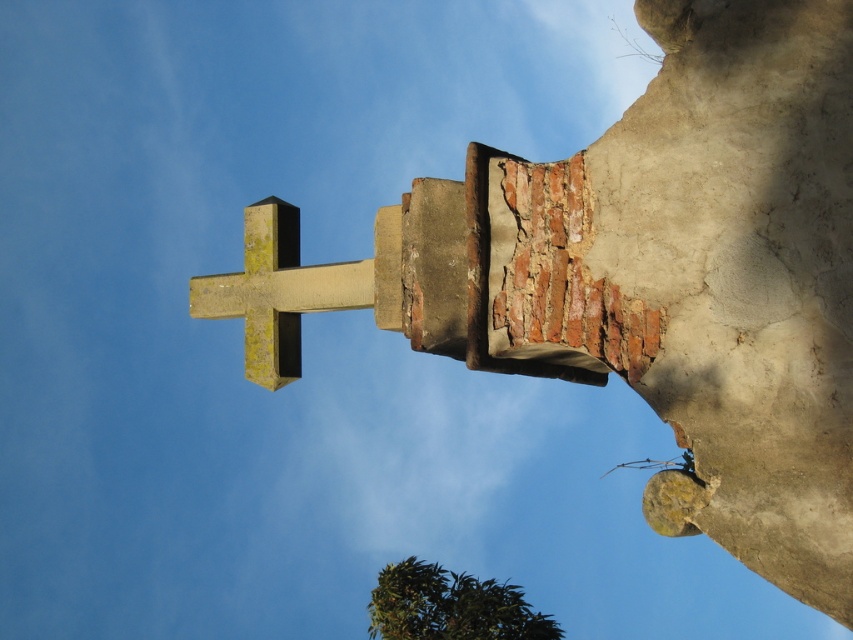
How distant is green mossy stone cross at center from green leafy tree at lower center?

green mossy stone cross at center and green leafy tree at lower center are 36.28 meters apart.

Is point (318, 272) more distant than point (538, 616)?

No, (318, 272) is closer to viewer.

Is point (285, 204) closer to viewer compared to point (521, 605)?

Yes, it is in front of point (521, 605).

The height and width of the screenshot is (640, 853). Identify the location of green mossy stone cross at center. (277, 291).